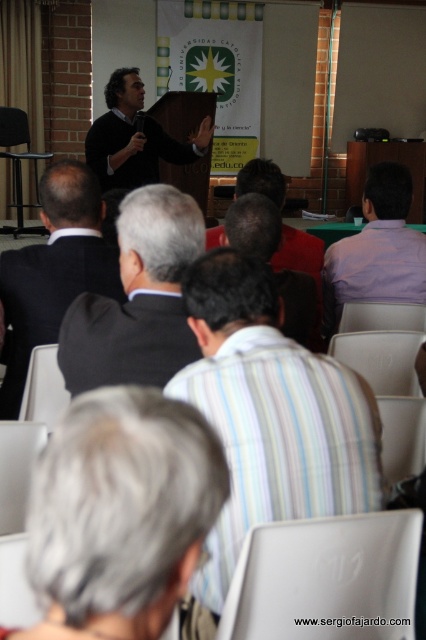
Which is in front, point (74, 164) or point (302, 236)?

Positioned in front is point (74, 164).

Which of these two, black suit at center or red shirt at center, stands shorter?

red shirt at center is shorter.

Between point (40, 326) and point (310, 269), which one is positioned in front?

Point (40, 326) is in front.

Find the location of a particular element. The image size is (426, 640). black suit at center is located at coordinates (54, 269).

Does gray striped shirt at lower center have a lesser width compared to dark gray suit at center?

Indeed, gray striped shirt at lower center has a lesser width compared to dark gray suit at center.

Does gray striped shirt at lower center come in front of dark gray suit at center?

Yes, it is in front of dark gray suit at center.

The image size is (426, 640). What do you see at coordinates (120, 513) in the screenshot?
I see `gray striped shirt at lower center` at bounding box center [120, 513].

Identify the location of gray striped shirt at lower center. This screenshot has width=426, height=640. (120, 513).

Is striped cotton shirt at center above dark gray suit at center?

No, striped cotton shirt at center is not above dark gray suit at center.

Is point (357, 442) behind point (190, 220)?

No, it is in front of (190, 220).

Image resolution: width=426 pixels, height=640 pixels. I want to click on striped cotton shirt at center, so click(x=270, y=413).